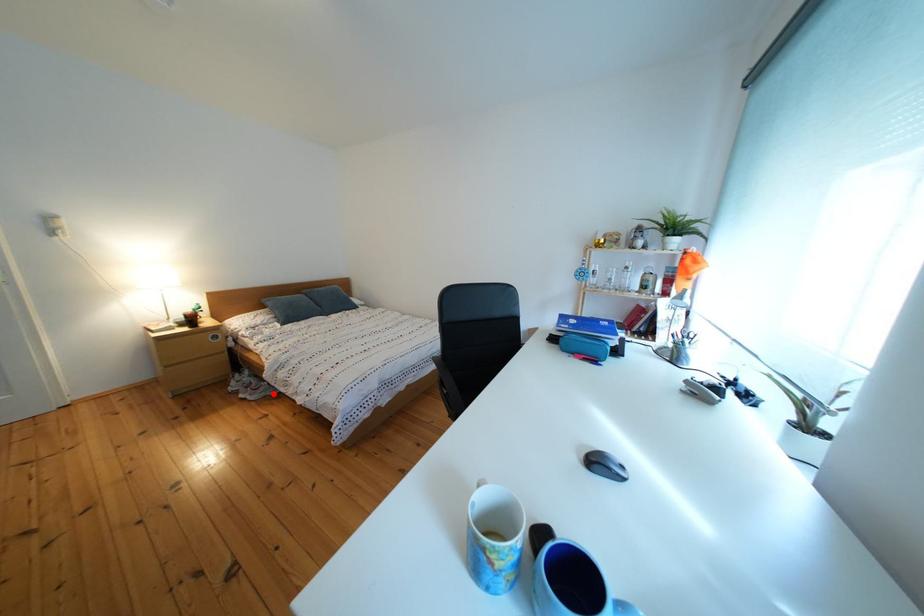
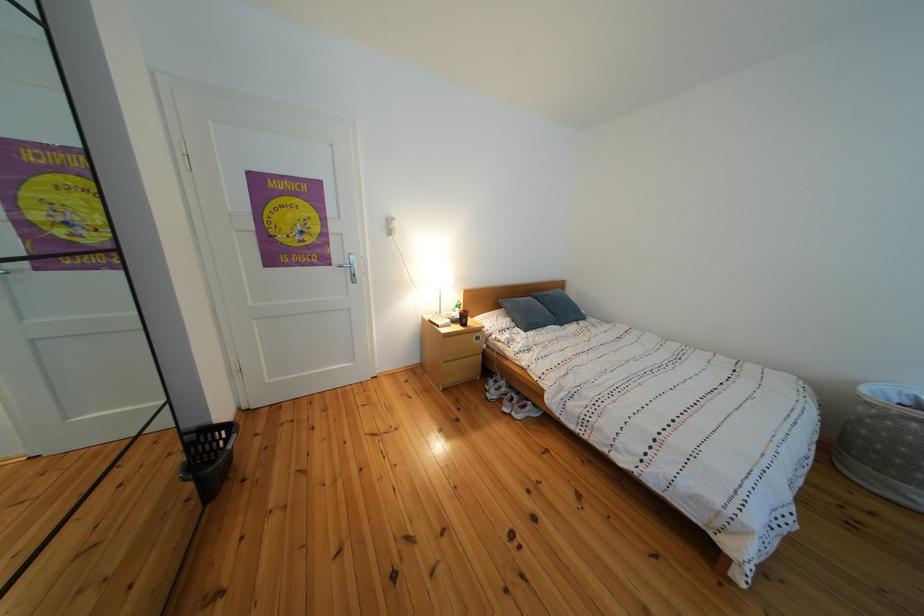
Where in the second image is the point corresponding to the highlighted location from the first image?

(540, 414)